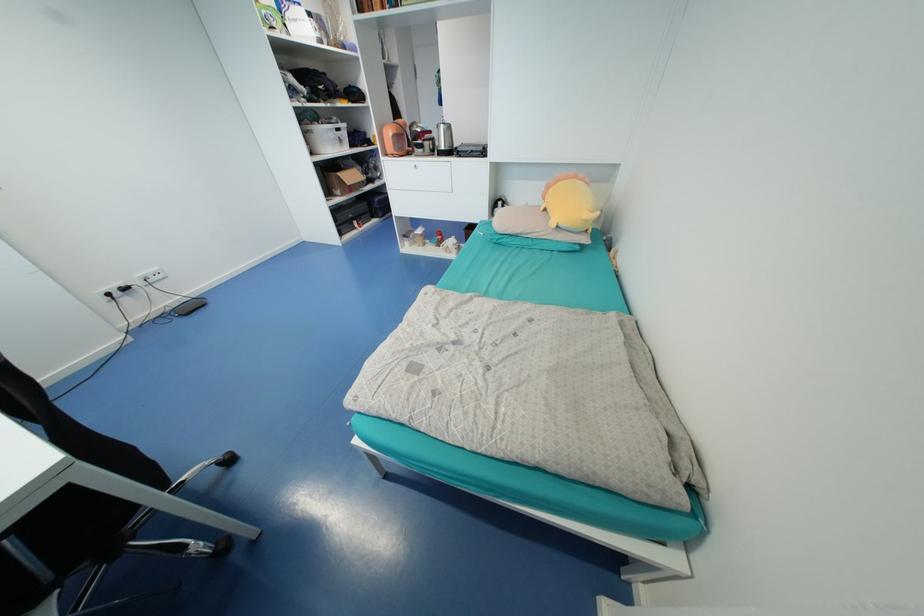
At what (x,y) coordinates should I click in order to perform the action: click on yellow plush toy. Please return your answer as a coordinate pair (x, y). Image resolution: width=924 pixels, height=616 pixels. Looking at the image, I should click on coord(569,203).